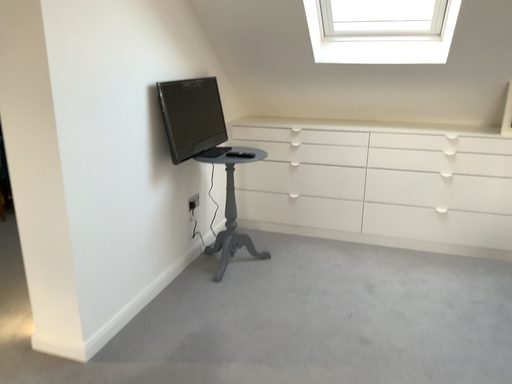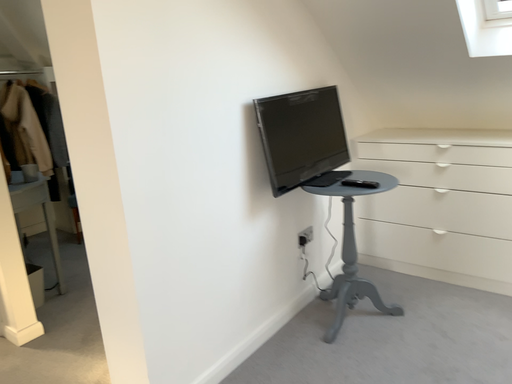
Question: Which way did the camera rotate in the video?

Choices:
 (A) rotated left
 (B) rotated right

Answer: (A)